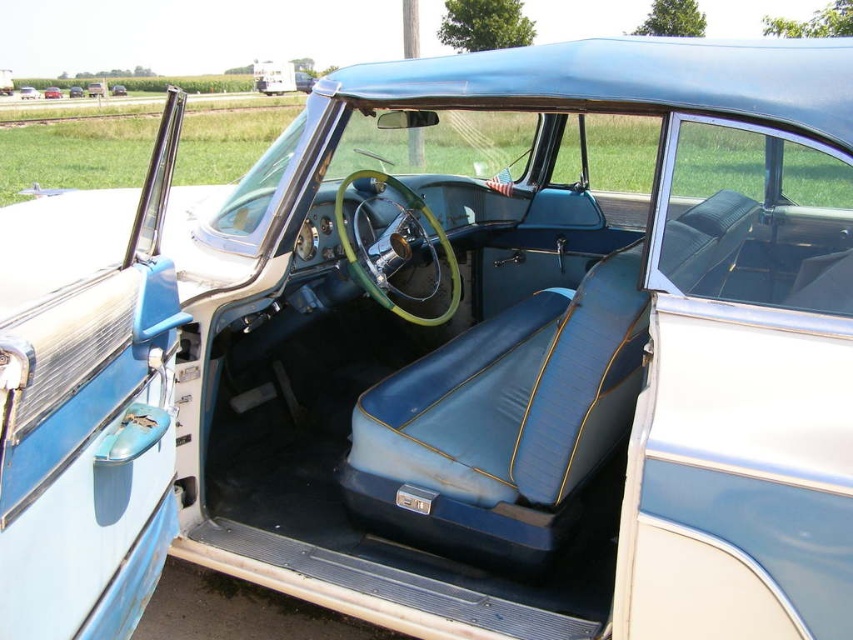
Is point (19, 97) farther from camera compared to point (56, 92)?

Yes, point (19, 97) is behind point (56, 92).

This screenshot has width=853, height=640. Describe the element at coordinates (28, 92) in the screenshot. I see `matte blue leather car at center` at that location.

Identify the location of matte blue leather car at center. The image size is (853, 640). (28, 92).